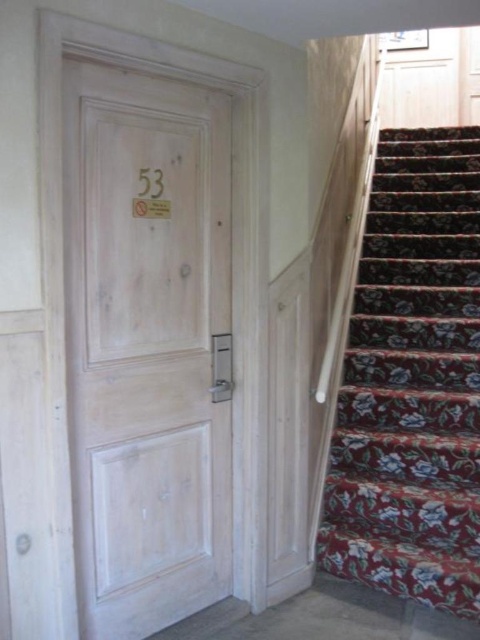
Question: Observing the image, what is the correct spatial positioning of white wood door at center in reference to floral carpet at right?

Choices:
 (A) right
 (B) left

Answer: (B)

Question: Which point is farther to the camera?

Choices:
 (A) (85, 216)
 (B) (367, 552)

Answer: (B)

Question: From the image, what is the correct spatial relationship of white wood door at center in relation to floral carpet at right?

Choices:
 (A) above
 (B) below

Answer: (A)

Question: Considering the relative positions of white wood door at center and floral carpet at right in the image provided, where is white wood door at center located with respect to floral carpet at right?

Choices:
 (A) below
 (B) above

Answer: (B)